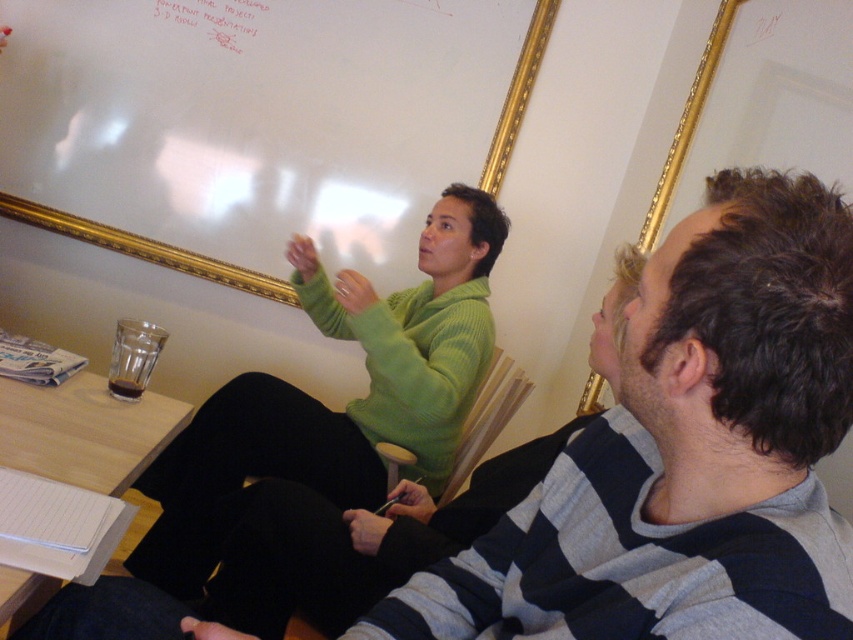
Is whiteboard at upper left smaller than white paper at upper center?

Incorrect, whiteboard at upper left is not smaller in size than white paper at upper center.

Is whiteboard at upper left wider than white paper at upper center?

Indeed, whiteboard at upper left has a greater width compared to white paper at upper center.

Between point (61, 218) and point (248, 36), which one is positioned in front?

Point (248, 36)

Where is `whiteboard at upper left`? Image resolution: width=853 pixels, height=640 pixels. whiteboard at upper left is located at coordinates pyautogui.click(x=143, y=248).